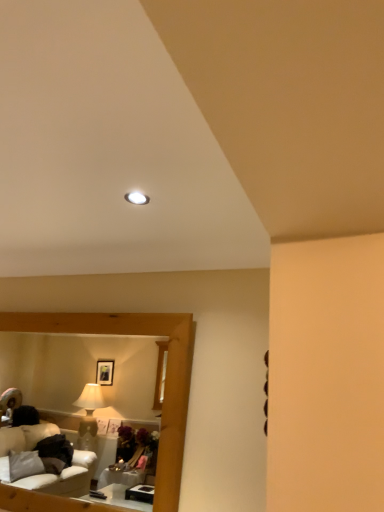
The width and height of the screenshot is (384, 512). What do you see at coordinates (167, 375) in the screenshot?
I see `wooden mirror at center` at bounding box center [167, 375].

Locate an element on the screen. This screenshot has height=512, width=384. wooden mirror at center is located at coordinates (167, 375).

Image resolution: width=384 pixels, height=512 pixels. In order to click on wooden mirror at center in this screenshot , I will do `click(167, 375)`.